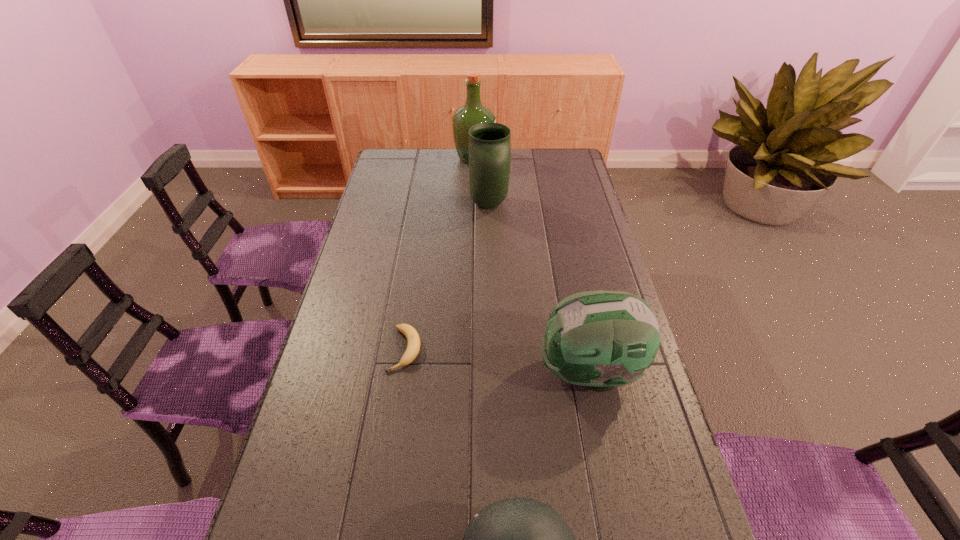
Locate an element on the screen. The height and width of the screenshot is (540, 960). vacant space located on the visor of the taller football helmet is located at coordinates (497, 372).

Locate an element on the screen. This screenshot has width=960, height=540. vacant region located 0.230m on the visor of the taller football helmet is located at coordinates (453, 372).

Identify the location of vacant space located at the stem of the leftmost object. This screenshot has height=540, width=960. (394, 426).

Identify the location of object that is at the far edge. Image resolution: width=960 pixels, height=540 pixels. (473, 112).

This screenshot has width=960, height=540. Find the location of `object present at the right edge`. object present at the right edge is located at coordinates (600, 339).

Locate an element on the screen. Image resolution: width=960 pixels, height=540 pixels. vacant region at the far edge of the desktop is located at coordinates (540, 157).

Identify the location of vacant region at the left edge of the desktop. (383, 255).

This screenshot has width=960, height=540. I want to click on vacant space at the right edge, so click(x=666, y=501).

The height and width of the screenshot is (540, 960). What are the coordinates of `vacant point at the far left corner` in the screenshot? It's located at (404, 167).

At what (x,y) coordinates should I click in order to perform the action: click on empty space that is in between the shortest object and the fourth nearest object. Please return your answer as a coordinate pair (x, y). Looking at the image, I should click on (447, 277).